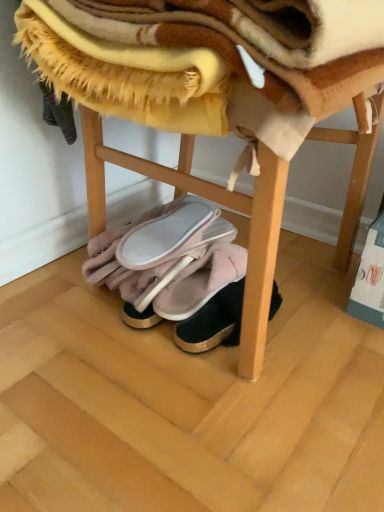
Question: From a real-world perspective, does pink fuzzy slippers at center, the third footwear viewed from the right, stand above velvet pink slippers at center, arranged as the 4th footwear when viewed from the left?

Choices:
 (A) yes
 (B) no

Answer: (A)

Question: Is pink fuzzy slippers at center, arranged as the second footwear when viewed from the left, directly adjacent to velvet pink slippers at center, which is counted as the 1th footwear, starting from the right?

Choices:
 (A) no
 (B) yes

Answer: (A)

Question: Can you confirm if pink fuzzy slippers at center, arranged as the second footwear when viewed from the left, is shorter than velvet pink slippers at center, which is counted as the 1th footwear, starting from the right?

Choices:
 (A) no
 (B) yes

Answer: (A)

Question: Considering the relative sizes of pink fuzzy slippers at center, arranged as the second footwear when viewed from the left, and velvet pink slippers at center, which is counted as the 1th footwear, starting from the right, in the image provided, is pink fuzzy slippers at center, arranged as the second footwear when viewed from the left, thinner than velvet pink slippers at center, which is counted as the 1th footwear, starting from the right,?

Choices:
 (A) yes
 (B) no

Answer: (B)

Question: Could velvet pink slippers at center, arranged as the 4th footwear when viewed from the left, be considered to be inside pink fuzzy slippers at center, arranged as the second footwear when viewed from the left?

Choices:
 (A) no
 (B) yes

Answer: (A)

Question: Is pink fuzzy slippers at center, arranged as the second footwear when viewed from the left, to the right of velvet pink slippers at center, which is counted as the 1th footwear, starting from the right, from the viewer's perspective?

Choices:
 (A) no
 (B) yes

Answer: (A)

Question: Considering the relative positions of pink suede slippers at lower center, acting as the 3th footwear starting from the left, and wooden stool at lower center in the image provided, is pink suede slippers at lower center, acting as the 3th footwear starting from the left, to the left of wooden stool at lower center from the viewer's perspective?

Choices:
 (A) yes
 (B) no

Answer: (B)

Question: Is pink suede slippers at lower center, the 2th footwear when ordered from right to left, shorter than wooden stool at lower center?

Choices:
 (A) no
 (B) yes

Answer: (B)

Question: Can you confirm if pink suede slippers at lower center, the 2th footwear when ordered from right to left, is taller than wooden stool at lower center?

Choices:
 (A) no
 (B) yes

Answer: (A)

Question: Can you confirm if pink suede slippers at lower center, acting as the 3th footwear starting from the left, is thinner than wooden stool at lower center?

Choices:
 (A) yes
 (B) no

Answer: (A)

Question: Does pink suede slippers at lower center, the 2th footwear when ordered from right to left, have a larger size compared to wooden stool at lower center?

Choices:
 (A) no
 (B) yes

Answer: (A)

Question: Considering the relative sizes of pink suede slippers at lower center, the 2th footwear when ordered from right to left, and wooden stool at lower center in the image provided, is pink suede slippers at lower center, the 2th footwear when ordered from right to left, wider than wooden stool at lower center?

Choices:
 (A) no
 (B) yes

Answer: (A)

Question: From the image's perspective, is pink fluffy slippers at lower center, the first footwear viewed from the left, beneath wooden stool at lower center?

Choices:
 (A) yes
 (B) no

Answer: (A)